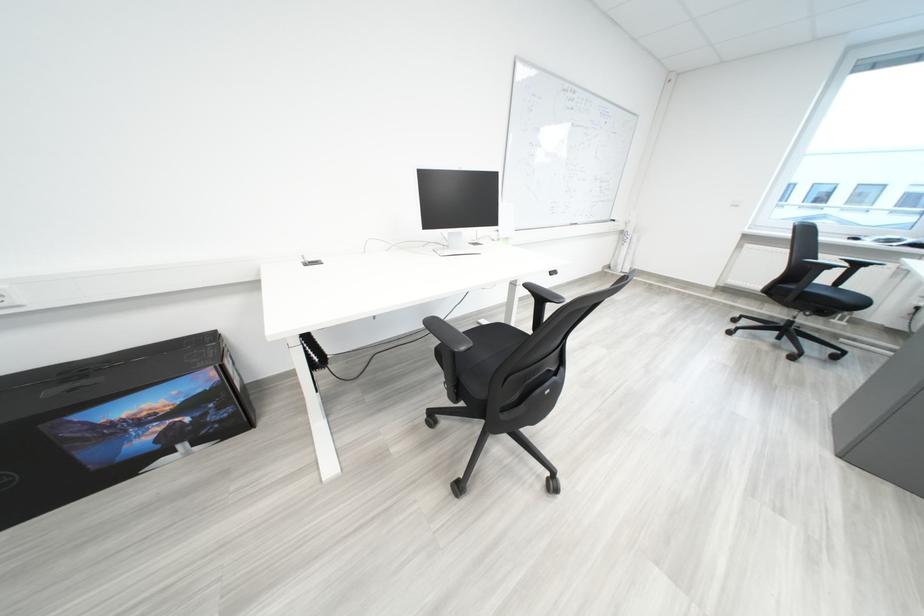
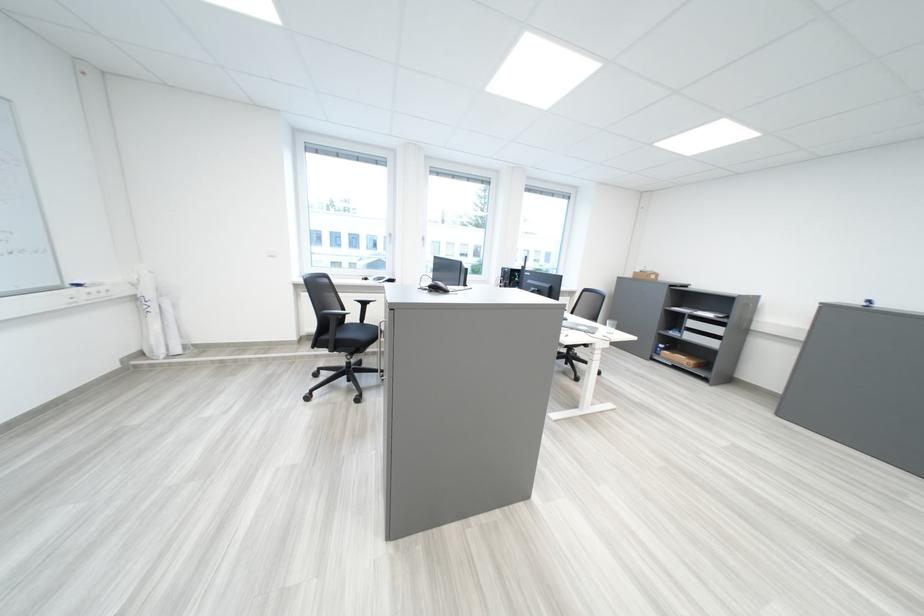
Locate, in the second image, the point that corresponds to [639,246] in the first image.

(166, 318)